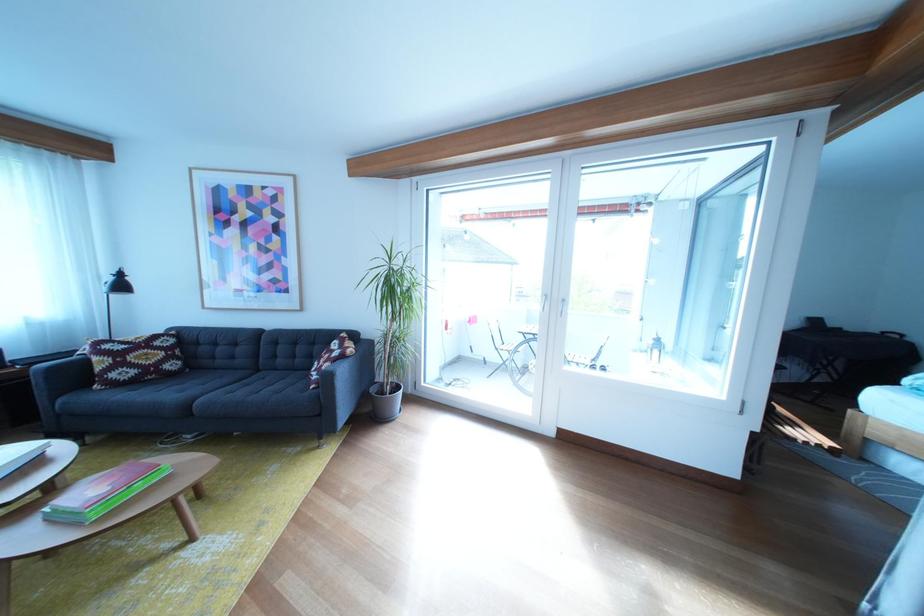
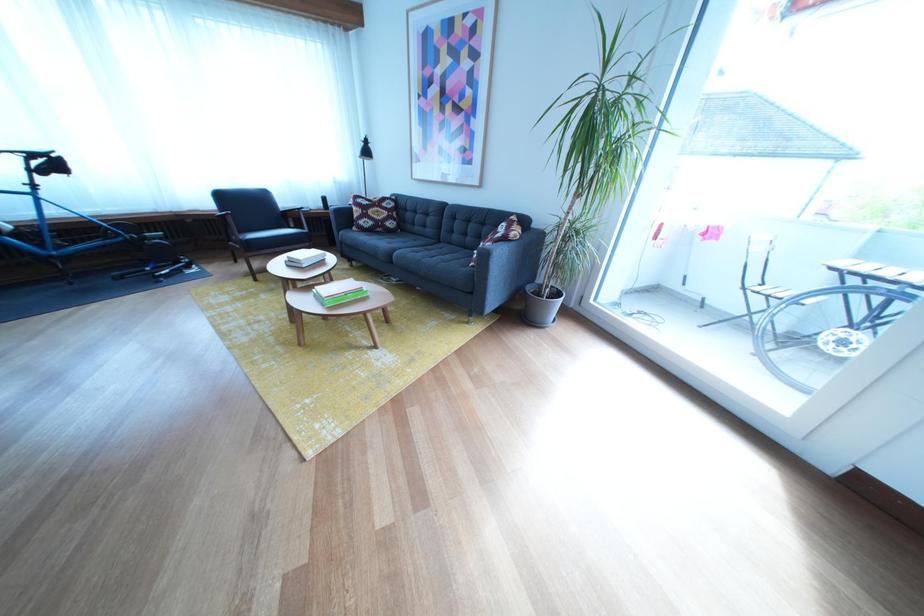
Find the pixel in the second image that matches [272,377] in the first image.

(453, 248)